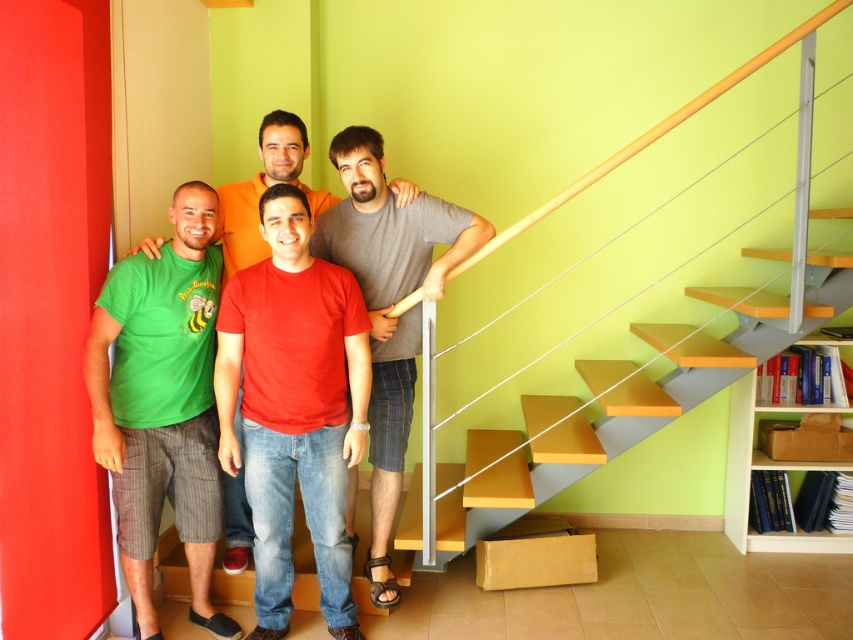
Between white wooden bookshelf at right and matte red t-shirt at center, which one appears on the left side from the viewer's perspective?

matte red t-shirt at center is more to the left.

Which of these two, white wooden bookshelf at right or matte red t-shirt at center, stands taller?

With more height is white wooden bookshelf at right.

I want to click on white wooden bookshelf at right, so click(x=766, y=467).

At what (x,y) coordinates should I click in order to perform the action: click on white wooden bookshelf at right. Please return your answer as a coordinate pair (x, y). Looking at the image, I should click on (766, 467).

Does point (270, 376) come farther from viewer compared to point (844, 209)?

No, (270, 376) is closer to viewer.

The width and height of the screenshot is (853, 640). Describe the element at coordinates (294, 406) in the screenshot. I see `red matte t-shirt at center` at that location.

Between point (312, 314) and point (810, 250), which one is positioned in front?

Positioned in front is point (312, 314).

The image size is (853, 640). Identify the location of red matte t-shirt at center. (294, 406).

Measure the distance between point (141, 525) and camera.

Point (141, 525) and camera are 2.66 meters apart from each other.

The image size is (853, 640). Describe the element at coordinates (161, 403) in the screenshot. I see `green matte t-shirt at left` at that location.

Is point (194, 412) more distant than point (405, 365)?

No, (194, 412) is closer to viewer.

Where is `green matte t-shirt at left`? green matte t-shirt at left is located at coordinates (161, 403).